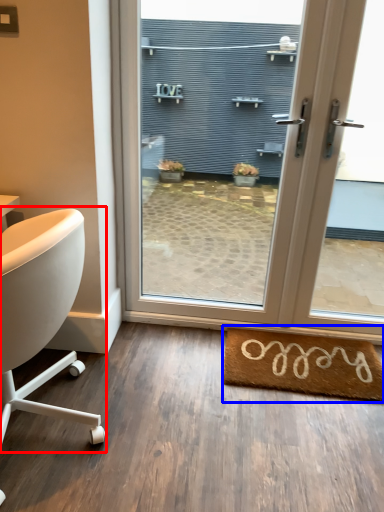
Question: Which of the following is the closest to the observer, chair (highlighted by a red box) or mat (highlighted by a blue box)?

Choices:
 (A) chair
 (B) mat

Answer: (A)